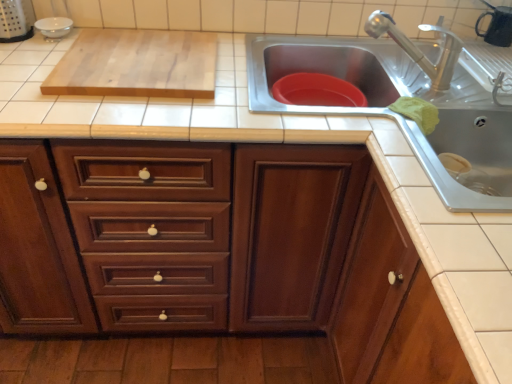
What do you see at coordinates (325, 69) in the screenshot? I see `stainless steel sink at upper right` at bounding box center [325, 69].

What do you see at coordinates (218, 250) in the screenshot?
I see `wooden cabinet at center, placed as the 2th cabinetry when sorted from right to left` at bounding box center [218, 250].

What is the approximate height of light wood cutting board at upper left?

It is 4.12 centimeters.

I want to click on stainless steel sink at upper right, so click(x=325, y=69).

Which of these two, wooden cabinet at center, placed as the 2th cabinetry when sorted from right to left, or stainless steel sink at upper right, stands shorter?

stainless steel sink at upper right.

Relative to stainless steel sink at upper right, is wooden cabinet at center, which is the first cabinetry from left to right, in front or behind?

wooden cabinet at center, which is the first cabinetry from left to right, is in front of stainless steel sink at upper right.

Is wooden cabinet at center, placed as the 2th cabinetry when sorted from right to left, not within stainless steel sink at upper right?

That's correct, wooden cabinet at center, placed as the 2th cabinetry when sorted from right to left, is outside of stainless steel sink at upper right.

From the image's perspective, does wooden cabinet at center, placed as the 2th cabinetry when sorted from right to left, appear higher than stainless steel sink at upper right?

No, from the image's perspective, wooden cabinet at center, placed as the 2th cabinetry when sorted from right to left, is not above stainless steel sink at upper right.

Is point (321, 180) positioned after point (67, 78)?

Yes, point (321, 180) is farther from viewer.

In the image, is wooden cabinet at center, placed as the 2th cabinetry when sorted from right to left, positioned in front of or behind light wood cutting board at upper left?

Result: wooden cabinet at center, placed as the 2th cabinetry when sorted from right to left, is positioned closer to the viewer than light wood cutting board at upper left.

From a real-world perspective, between wooden cabinet at center, placed as the 2th cabinetry when sorted from right to left, and light wood cutting board at upper left, who is vertically lower?

wooden cabinet at center, placed as the 2th cabinetry when sorted from right to left.

Which point is more distant from viewer, (399, 87) or (165, 50)?

Positioned behind is point (399, 87).

Can you confirm if stainless steel sink at upper right is shorter than light wood cutting board at upper left?

In fact, stainless steel sink at upper right may be taller than light wood cutting board at upper left.

From a real-world perspective, is stainless steel sink at upper right located beneath light wood cutting board at upper left?

Yes.

From the image's perspective, which object appears higher, stainless steel sink at upper right or light wood cutting board at upper left?

light wood cutting board at upper left, from the image's perspective.

Would you say wooden cabinet at lower right, which ranks as the 1th cabinetry in right-to-left order, contains light wood cutting board at upper left?

No, light wood cutting board at upper left is not surrounded by wooden cabinet at lower right, which ranks as the 1th cabinetry in right-to-left order.

Looking at this image, between wooden cabinet at lower right, which ranks as the 1th cabinetry in right-to-left order, and light wood cutting board at upper left, which one has smaller width?

light wood cutting board at upper left.

From a real-world perspective, is wooden cabinet at lower right, the 2th cabinetry viewed from the left, located higher than light wood cutting board at upper left?

No, from a real-world perspective, wooden cabinet at lower right, the 2th cabinetry viewed from the left, is not on top of light wood cutting board at upper left.

Considering the positions of objects wooden cabinet at lower right, the 2th cabinetry viewed from the left, and light wood cutting board at upper left in the image provided, who is more to the left, wooden cabinet at lower right, the 2th cabinetry viewed from the left, or light wood cutting board at upper left?

light wood cutting board at upper left is more to the left.

From the image's perspective, is light wood cutting board at upper left located above or below wooden cabinet at lower right, the 2th cabinetry viewed from the left?

From the image's perspective, light wood cutting board at upper left appears above wooden cabinet at lower right, the 2th cabinetry viewed from the left.

Could wooden cabinet at lower right, which ranks as the 1th cabinetry in right-to-left order, be considered to be inside light wood cutting board at upper left?

No, wooden cabinet at lower right, which ranks as the 1th cabinetry in right-to-left order, is not surrounded by light wood cutting board at upper left.

From a real-world perspective, is light wood cutting board at upper left positioned under wooden cabinet at lower right, the 2th cabinetry viewed from the left, based on gravity?

No, from a real-world perspective, light wood cutting board at upper left is not beneath wooden cabinet at lower right, the 2th cabinetry viewed from the left.

Would you consider light wood cutting board at upper left to be distant from wooden cabinet at lower right, which ranks as the 1th cabinetry in right-to-left order?

No, light wood cutting board at upper left is not far from wooden cabinet at lower right, which ranks as the 1th cabinetry in right-to-left order.

Between wooden cabinet at center, placed as the 2th cabinetry when sorted from right to left, and wooden cabinet at lower right, which ranks as the 1th cabinetry in right-to-left order, which one appears on the right side from the viewer's perspective?

wooden cabinet at lower right, which ranks as the 1th cabinetry in right-to-left order, is more to the right.

From a real-world perspective, which is physically above, wooden cabinet at center, placed as the 2th cabinetry when sorted from right to left, or wooden cabinet at lower right, the 2th cabinetry viewed from the left?

wooden cabinet at lower right, the 2th cabinetry viewed from the left, is physically above.

What's the angular difference between wooden cabinet at center, which is the first cabinetry from left to right, and wooden cabinet at lower right, which ranks as the 1th cabinetry in right-to-left order,'s facing directions?

There is a 91-degree angle between the facing directions of wooden cabinet at center, which is the first cabinetry from left to right, and wooden cabinet at lower right, which ranks as the 1th cabinetry in right-to-left order.

Does wooden cabinet at center, placed as the 2th cabinetry when sorted from right to left, contain wooden cabinet at lower right, the 2th cabinetry viewed from the left?

Yes.

Is stainless steel sink at upper right wider or thinner than wooden cabinet at center, placed as the 2th cabinetry when sorted from right to left?

Clearly, stainless steel sink at upper right has less width compared to wooden cabinet at center, placed as the 2th cabinetry when sorted from right to left.

The image size is (512, 384). In order to click on sink lying on the right of wooden cabinet at center, which is the first cabinetry from left to right in this screenshot , I will do `click(325, 69)`.

From the image's perspective, is stainless steel sink at upper right located beneath wooden cabinet at center, which is the first cabinetry from left to right?

Actually, stainless steel sink at upper right appears above wooden cabinet at center, which is the first cabinetry from left to right, in the image.

Does point (360, 57) appear closer or farther from the camera than point (341, 195)?

Point (360, 57) is farther from the camera than point (341, 195).

Find the location of a particular element. sink located above the wooden cabinet at center, which is the first cabinetry from left to right (from a real-world perspective) is located at coordinates (325, 69).

Identify the location of wide on the left of wooden cabinet at center, which is the first cabinetry from left to right. The image size is (512, 384). (136, 64).

In the scene shown: Looking at the image, which one is located further to wooden cabinet at lower right, which ranks as the 1th cabinetry in right-to-left order, stainless steel sink at upper right or light wood cutting board at upper left?

The object further to wooden cabinet at lower right, which ranks as the 1th cabinetry in right-to-left order, is light wood cutting board at upper left.

Based on the photo, from the image, which object appears to be nearer to stainless steel sink at upper right, wooden cabinet at center, placed as the 2th cabinetry when sorted from right to left, or wooden cabinet at lower right, the 2th cabinetry viewed from the left?

wooden cabinet at lower right, the 2th cabinetry viewed from the left, is closer to stainless steel sink at upper right.

From the image, which object appears to be farther from stainless steel sink at upper right, light wood cutting board at upper left or wooden cabinet at lower right, which ranks as the 1th cabinetry in right-to-left order?

wooden cabinet at lower right, which ranks as the 1th cabinetry in right-to-left order, is further to stainless steel sink at upper right.

From the image, which object appears to be nearer to wooden cabinet at center, which is the first cabinetry from left to right, stainless steel sink at upper right or light wood cutting board at upper left?

light wood cutting board at upper left is closer to wooden cabinet at center, which is the first cabinetry from left to right.

Consider the image. Based on their spatial positions, is light wood cutting board at upper left or stainless steel sink at upper right further from wooden cabinet at lower right, the 2th cabinetry viewed from the left?

light wood cutting board at upper left.

Looking at the image, which one is located further to light wood cutting board at upper left, wooden cabinet at center, placed as the 2th cabinetry when sorted from right to left, or stainless steel sink at upper right?

Among the two, wooden cabinet at center, placed as the 2th cabinetry when sorted from right to left, is located further to light wood cutting board at upper left.

Looking at the image, which one is located closer to wooden cabinet at lower right, which ranks as the 1th cabinetry in right-to-left order, wooden cabinet at center, which is the first cabinetry from left to right, or light wood cutting board at upper left?

wooden cabinet at center, which is the first cabinetry from left to right, lies closer to wooden cabinet at lower right, which ranks as the 1th cabinetry in right-to-left order, than the other object.

Considering their positions, is wooden cabinet at center, placed as the 2th cabinetry when sorted from right to left, positioned further to stainless steel sink at upper right than light wood cutting board at upper left?

wooden cabinet at center, placed as the 2th cabinetry when sorted from right to left.

Locate an element on the screen. Image resolution: width=512 pixels, height=384 pixels. sink between light wood cutting board at upper left and wooden cabinet at lower right, the 2th cabinetry viewed from the left, in the horizontal direction is located at coordinates (325, 69).

Where is `cabinetry located between light wood cutting board at upper left and wooden cabinet at lower right, the 2th cabinetry viewed from the left, in the left-right direction`? cabinetry located between light wood cutting board at upper left and wooden cabinet at lower right, the 2th cabinetry viewed from the left, in the left-right direction is located at coordinates (218, 250).

This screenshot has height=384, width=512. I want to click on wide between wooden cabinet at center, placed as the 2th cabinetry when sorted from right to left, and stainless steel sink at upper right from front to back, so click(x=136, y=64).

Identify the location of sink between wooden cabinet at center, placed as the 2th cabinetry when sorted from right to left, and wooden cabinet at lower right, the 2th cabinetry viewed from the left, in the horizontal direction. (325, 69).